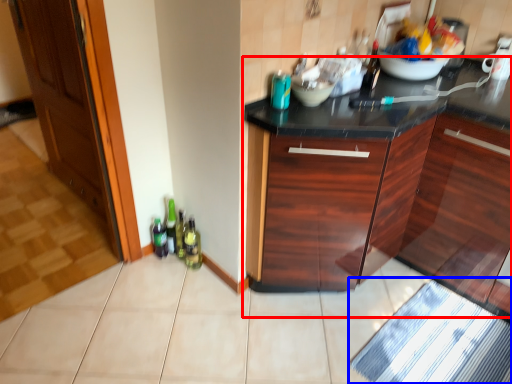
Question: Which object is closer to the camera taking this photo, cabinetry (highlighted by a red box) or bath mat (highlighted by a blue box)?

Choices:
 (A) cabinetry
 (B) bath mat

Answer: (A)